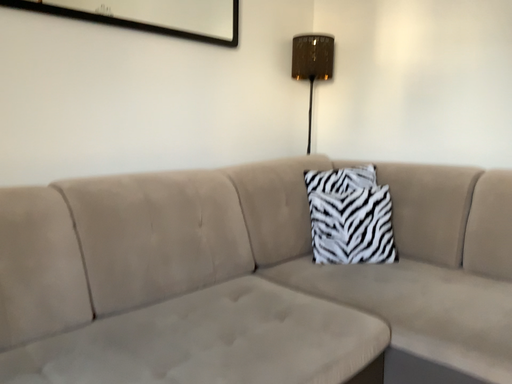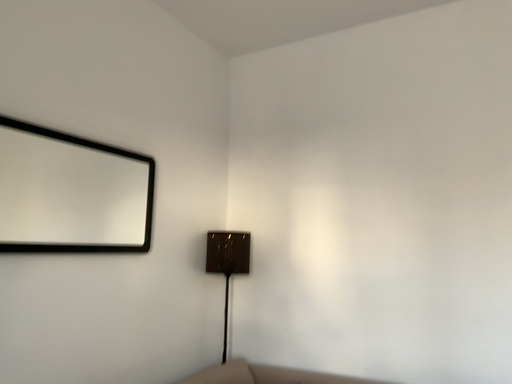
Question: Which way did the camera rotate in the video?

Choices:
 (A) rotated downward
 (B) rotated upward

Answer: (B)